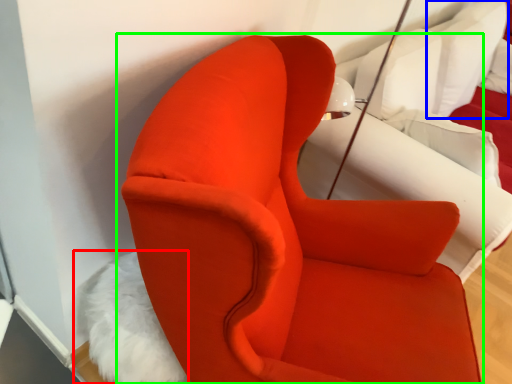
Question: Which is nearer to the animal (highlighted by a red box)? pillow (highlighted by a blue box) or chair (highlighted by a green box).

Choices:
 (A) pillow
 (B) chair

Answer: (B)